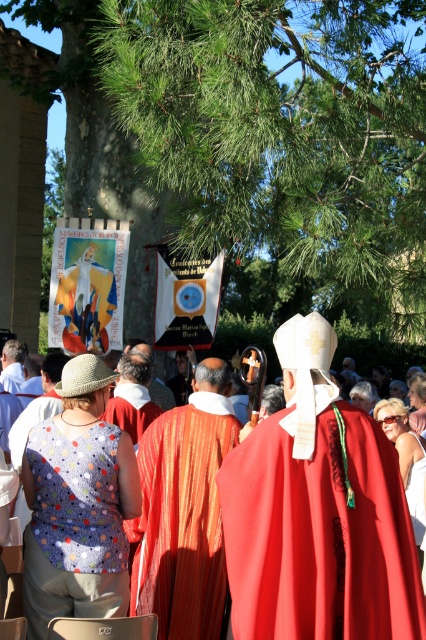
Does matte red cape at center have a larger size compared to orange silk robe at center?

Yes, matte red cape at center is bigger than orange silk robe at center.

Which of these two, matte red cape at center or orange silk robe at center, stands shorter?

With less height is orange silk robe at center.

Between point (417, 621) and point (198, 417), which one is positioned behind?

Point (198, 417)

Locate an element on the screen. matte red cape at center is located at coordinates (317, 513).

Which is below, red velvet cape at center or matte red cape at center?

matte red cape at center is below.

Who is taller, red velvet cape at center or matte red cape at center?

matte red cape at center is taller.

Is point (247, 582) positioned behind point (219, 490)?

That is False.

You are a GUI agent. You are given a task and a screenshot of the screen. Output one action in this format:
    pyautogui.click(x=<x>, y=<y>)
    Task: Click on the red velvet cape at center
    The height and width of the screenshot is (640, 426).
    Given the screenshot: What is the action you would take?
    pyautogui.click(x=317, y=513)

From the picture: How much distance is there between red velvet cape at center and orange silk robe at center?

The distance of red velvet cape at center from orange silk robe at center is 1.42 meters.

Is red velvet cape at center thinner than orange silk robe at center?

No, red velvet cape at center is not thinner than orange silk robe at center.

Where is `red velvet cape at center`? red velvet cape at center is located at coordinates (317, 513).